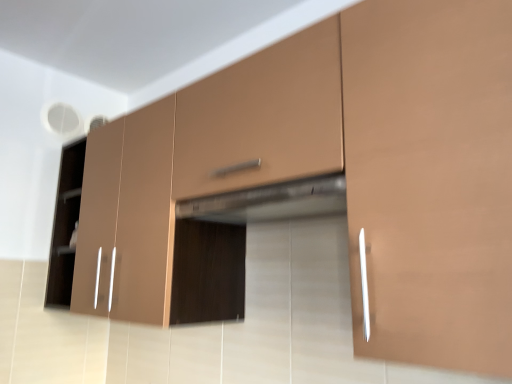
Question: Does matte brown cabinet at center, the 2th cabinetry from the right, have a greater width compared to matte brown drawer at center?

Choices:
 (A) yes
 (B) no

Answer: (A)

Question: From the image's perspective, is matte brown cabinet at center, the second cabinetry when ordered from front to back, on top of matte brown drawer at center?

Choices:
 (A) yes
 (B) no

Answer: (B)

Question: Does matte brown cabinet at center, which is the 1th cabinetry from back to front, have a smaller size compared to matte brown drawer at center?

Choices:
 (A) yes
 (B) no

Answer: (B)

Question: Is matte brown cabinet at center, the second cabinetry when ordered from front to back, next to matte brown drawer at center and touching it?

Choices:
 (A) yes
 (B) no

Answer: (B)

Question: Is there a large distance between matte brown cabinet at center, the 2th cabinetry from the right, and matte brown drawer at center?

Choices:
 (A) no
 (B) yes

Answer: (A)

Question: Can you confirm if matte brown cabinet at center, arranged as the first cabinetry when viewed from the left, is thinner than matte brown drawer at center?

Choices:
 (A) no
 (B) yes

Answer: (A)

Question: Is satin metallic exhaust hood at center at the left side of matte brown drawer at center?

Choices:
 (A) yes
 (B) no

Answer: (B)

Question: Can you confirm if satin metallic exhaust hood at center is thinner than matte brown drawer at center?

Choices:
 (A) yes
 (B) no

Answer: (A)

Question: Can you confirm if satin metallic exhaust hood at center is positioned to the right of matte brown drawer at center?

Choices:
 (A) no
 (B) yes

Answer: (B)

Question: Is satin metallic exhaust hood at center wider than matte brown drawer at center?

Choices:
 (A) no
 (B) yes

Answer: (A)

Question: Is the position of satin metallic exhaust hood at center more distant than that of matte brown drawer at center?

Choices:
 (A) no
 (B) yes

Answer: (B)

Question: From a real-world perspective, is satin metallic exhaust hood at center physically above matte brown drawer at center?

Choices:
 (A) no
 (B) yes

Answer: (A)

Question: Does satin metallic exhaust hood at center turn towards matte brown cabinet at center, the second cabinetry when ordered from front to back?

Choices:
 (A) no
 (B) yes

Answer: (A)